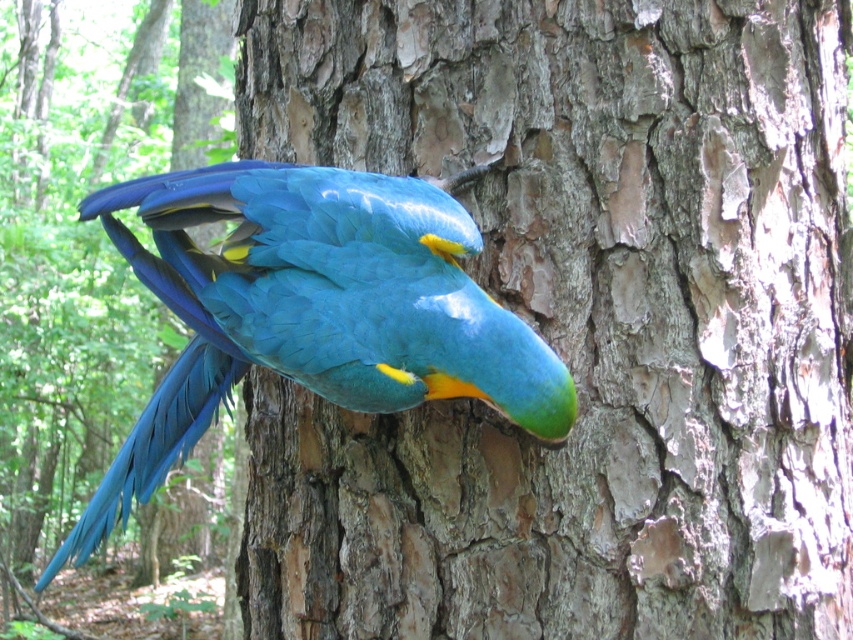
Question: Among these points, which one is nearest to the camera?

Choices:
 (A) (787, 355)
 (B) (321, 376)

Answer: (B)

Question: Can you confirm if rough bark tree trunk at center is positioned to the right of blue glossy parrot at center?

Choices:
 (A) no
 (B) yes

Answer: (B)

Question: Is rough bark tree trunk at center positioned in front of blue glossy parrot at center?

Choices:
 (A) yes
 (B) no

Answer: (B)

Question: Among these points, which one is nearest to the camera?

Choices:
 (A) (576, 296)
 (B) (426, 189)

Answer: (B)

Question: Is rough bark tree trunk at center thinner than blue glossy parrot at center?

Choices:
 (A) no
 (B) yes

Answer: (A)

Question: Among these objects, which one is farthest from the camera?

Choices:
 (A) blue glossy parrot at center
 (B) rough bark tree trunk at center

Answer: (B)